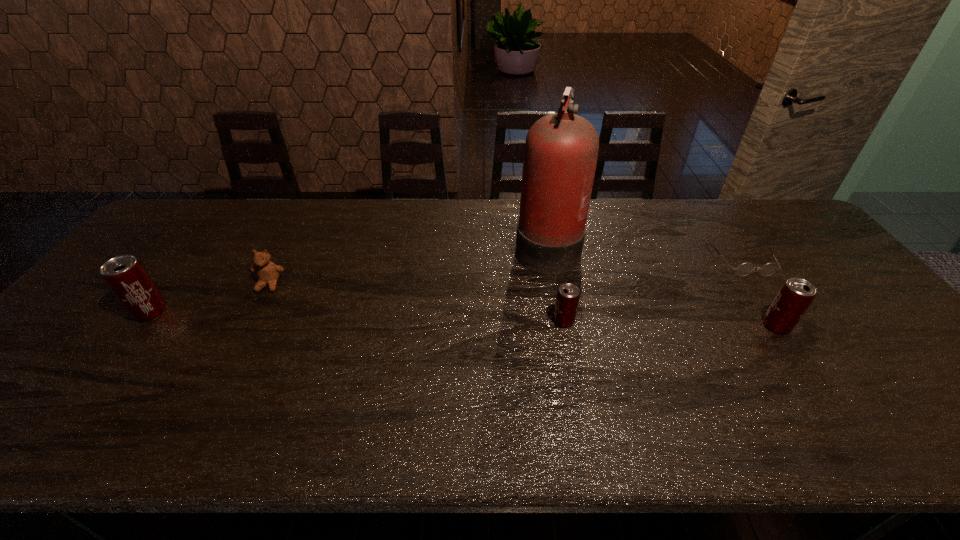
In the image, there is a desktop. Where is `vacant space at the right edge`? The image size is (960, 540). vacant space at the right edge is located at coordinates (877, 353).

The height and width of the screenshot is (540, 960). I want to click on vacant region at the far left corner of the desktop, so click(x=175, y=236).

Identify the location of vacant space at the far right corner of the desktop. (767, 198).

The width and height of the screenshot is (960, 540). What are the coordinates of `free space at the near right corner of the desktop` in the screenshot? It's located at (886, 390).

Find the location of a particular element. free space between the leftmost object and the shortest object is located at coordinates (446, 286).

Identify the location of free space between the shortest beer can and the tallest object. (555, 283).

The image size is (960, 540). I want to click on vacant space that is in between the tallest object and the second shortest beer can, so click(x=661, y=285).

Locate an element on the screen. The width and height of the screenshot is (960, 540). free space between the rightmost beer can and the teddy bear is located at coordinates (523, 305).

You are a GUI agent. You are given a task and a screenshot of the screen. Output one action in this format:
    pyautogui.click(x=<x>, y=<y>)
    Task: Click on the vacant space in between the second tallest beer can and the spectacles
    The width and height of the screenshot is (960, 540).
    Given the screenshot: What is the action you would take?
    pyautogui.click(x=759, y=293)

What are the coordinates of `vacant area that lies between the spectacles and the teddy bear` in the screenshot? It's located at (506, 272).